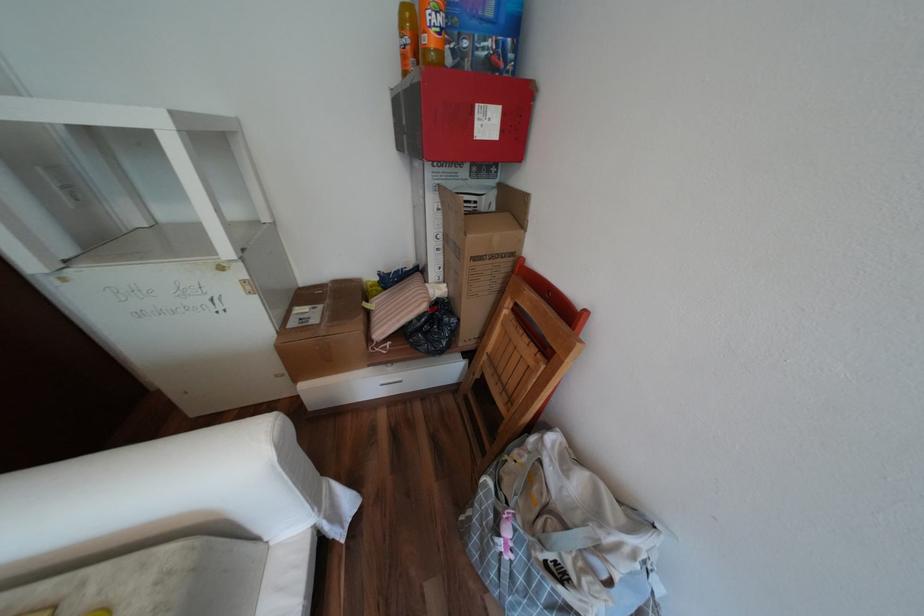
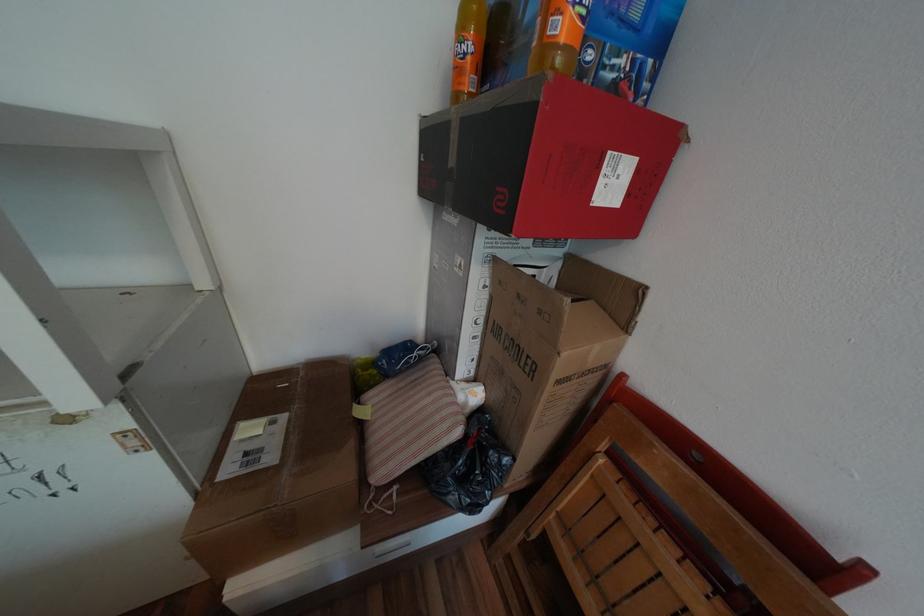
Locate, in the second image, the point that corresponds to (x=330, y=306) in the first image.

(293, 416)